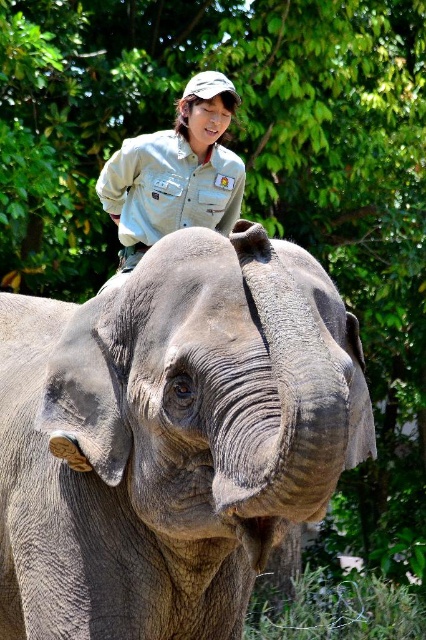
You are a wildlife photographer aiming to capture a clear shot of both the gray textured elephant at center and the light brown uniform at upper center. Based on their positions, which subject is easier to focus on?

The gray textured elephant at center is closer to the viewer than the light brown uniform at upper center, so it will be easier to focus on the gray textured elephant at center.

Consider the image. You are standing in front of the elephant and see a point marked at coordinates [172,436]. Which object is this point located on?

The point at [172,436] is located on the gray textured elephant at center.

You are a wildlife photographer trying to capture a photo of the gray textured elephant at center and the light brown uniform at upper center. Based on their sizes, which one should you focus on to ensure both are clearly visible in the frame?

The gray textured elephant at center is bigger than the light brown uniform at upper center. To ensure both are clearly visible, focus on the gray textured elephant at center since it occupies more space in the frame.